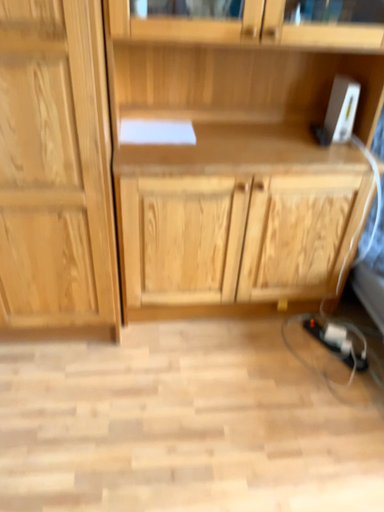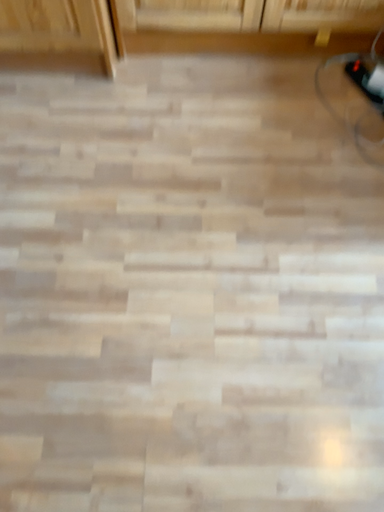
Question: How did the camera likely rotate when shooting the video?

Choices:
 (A) rotated upward
 (B) rotated downward

Answer: (B)